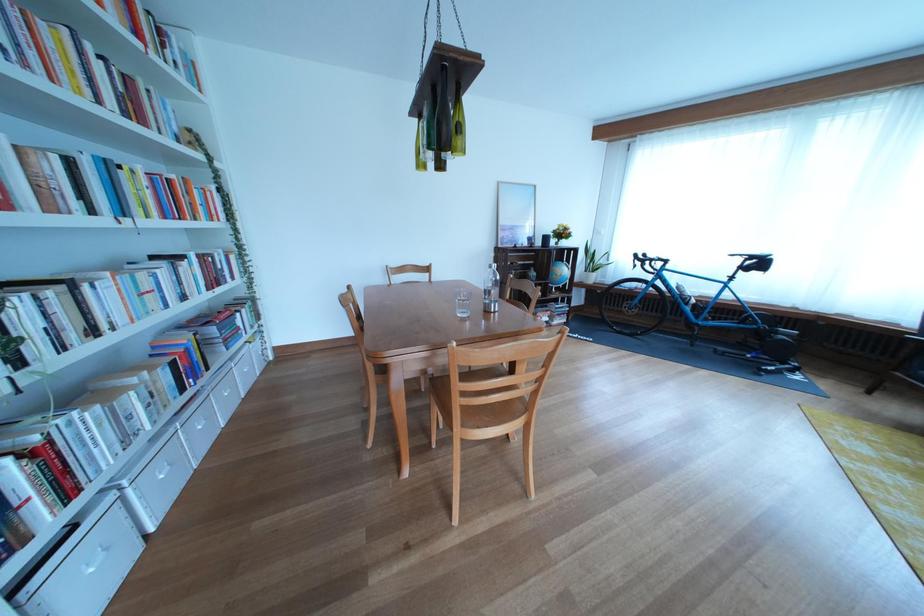
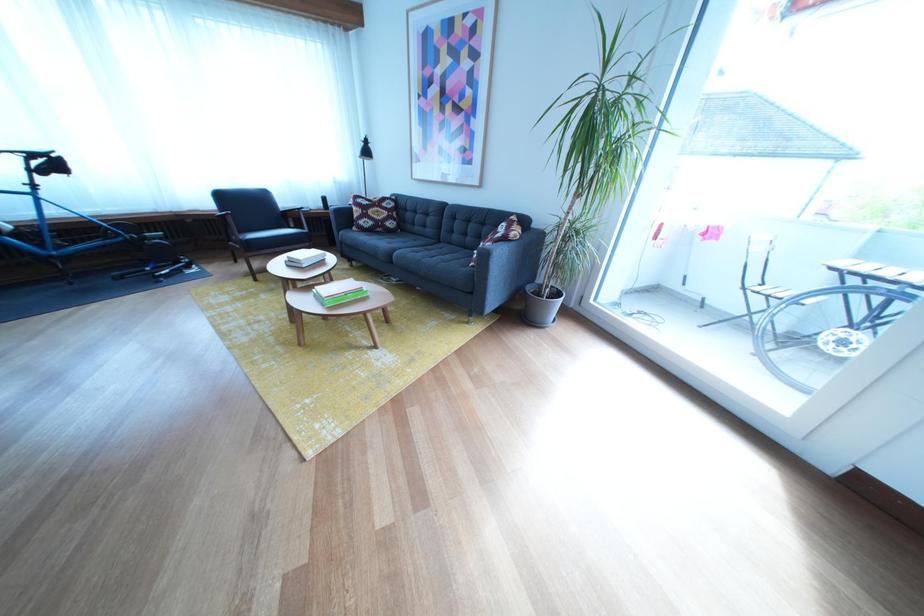
In the second image, find the point that corresponds to point 772,270 in the first image.

(64, 169)